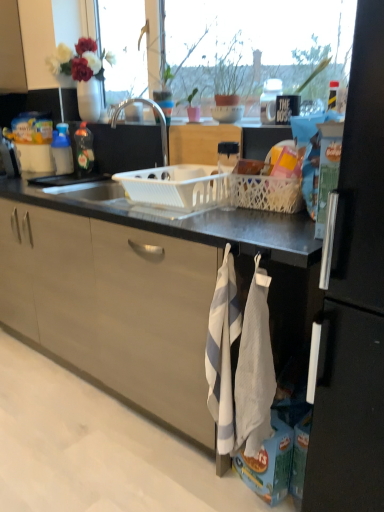
Question: Does white mesh basket at right, positioned as the 1th basket in right-to-left order, have a greater width compared to white textured hand towel at lower right, the 2th hand towel when ordered from left to right?

Choices:
 (A) no
 (B) yes

Answer: (B)

Question: From a real-world perspective, does white mesh basket at right, positioned as the 1th basket in right-to-left order, sit lower than white textured hand towel at lower right, the 2th hand towel when ordered from left to right?

Choices:
 (A) no
 (B) yes

Answer: (A)

Question: Does white mesh basket at right, positioned as the 1th basket in right-to-left order, have a lesser width compared to white textured hand towel at lower right, the 2th hand towel when ordered from left to right?

Choices:
 (A) yes
 (B) no

Answer: (B)

Question: From a real-world perspective, is white mesh basket at right, positioned as the 1th basket in right-to-left order, on top of white textured hand towel at lower right, which ranks as the 1th hand towel in right-to-left order?

Choices:
 (A) yes
 (B) no

Answer: (A)

Question: From the image's perspective, would you say white mesh basket at right, the second basket positioned from the left, is positioned over white textured hand towel at lower right, the 2th hand towel when ordered from left to right?

Choices:
 (A) yes
 (B) no

Answer: (A)

Question: Based on their sizes in the image, would you say blue plastic bottle at left, the 2th kitchen appliance in the right-to-left sequence, is bigger or smaller than white plastic basket at center, which is the 2th basket from right to left?

Choices:
 (A) big
 (B) small

Answer: (B)

Question: Relative to white plastic basket at center, arranged as the first basket when viewed from the left, is blue plastic bottle at left, placed as the 1th kitchen appliance when sorted from left to right, in front or behind?

Choices:
 (A) front
 (B) behind

Answer: (B)

Question: Considering the relative positions of blue plastic bottle at left, placed as the 1th kitchen appliance when sorted from left to right, and white plastic basket at center, arranged as the first basket when viewed from the left, in the image provided, is blue plastic bottle at left, placed as the 1th kitchen appliance when sorted from left to right, to the left or to the right of white plastic basket at center, arranged as the first basket when viewed from the left,?

Choices:
 (A) right
 (B) left

Answer: (B)

Question: Choose the correct answer: Is blue plastic bottle at left, placed as the 1th kitchen appliance when sorted from left to right, inside white plastic basket at center, arranged as the first basket when viewed from the left, or outside it?

Choices:
 (A) inside
 (B) outside

Answer: (B)

Question: Visually, is matte black mug at upper center positioned to the left or to the right of white textured hand towel at lower right, which ranks as the 1th hand towel in right-to-left order?

Choices:
 (A) left
 (B) right

Answer: (B)

Question: Considering the positions of point (264, 121) and point (273, 394), is point (264, 121) closer or farther from the camera than point (273, 394)?

Choices:
 (A) closer
 (B) farther

Answer: (B)

Question: Considering the positions of matte black mug at upper center and white textured hand towel at lower right, the 2th hand towel when ordered from left to right, in the image, is matte black mug at upper center taller or shorter than white textured hand towel at lower right, the 2th hand towel when ordered from left to right,?

Choices:
 (A) short
 (B) tall

Answer: (A)

Question: Based on their sizes in the image, would you say matte black mug at upper center is bigger or smaller than white textured hand towel at lower right, the 2th hand towel when ordered from left to right?

Choices:
 (A) small
 (B) big

Answer: (A)

Question: Considering the positions of point (221, 362) and point (89, 148), is point (221, 362) closer or farther from the camera than point (89, 148)?

Choices:
 (A) closer
 (B) farther

Answer: (A)

Question: Is white textured hand towel at lower center, which is the first hand towel from left to right, taller or shorter than translucent plastic bottle at left, acting as the first kitchen appliance starting from the right?

Choices:
 (A) tall
 (B) short

Answer: (A)